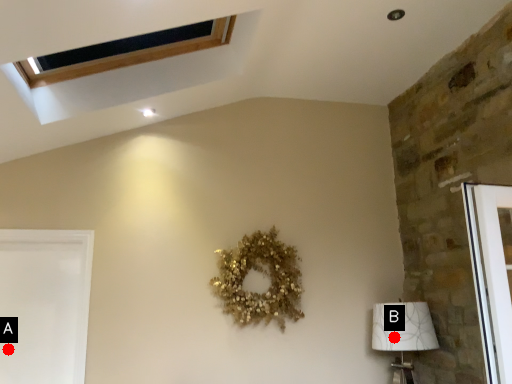
Question: Two points are circled on the image, labeled by A and B beside each circle. Which point appears closest to the camera in this image?

Choices:
 (A) A is closer
 (B) B is closer

Answer: (A)